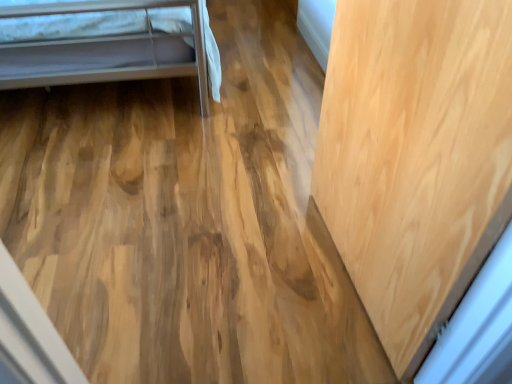
You are a GUI agent. You are given a task and a screenshot of the screen. Output one action in this format:
    pyautogui.click(x=<x>, y=<y>)
    Task: Click on the free point in front of light wood door at right
    
    Given the screenshot: What is the action you would take?
    pyautogui.click(x=322, y=329)